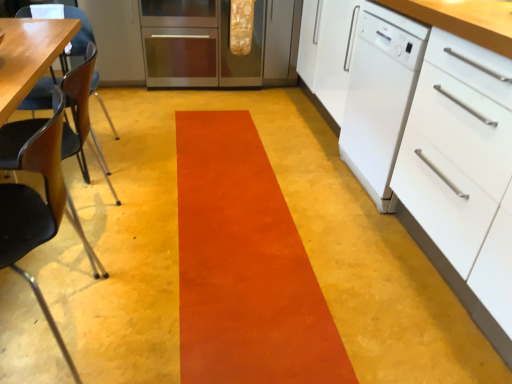
Identify the location of vacant area that is situated to the right of black plastic chair at left, the 2th chair positioned from the back. (168, 317).